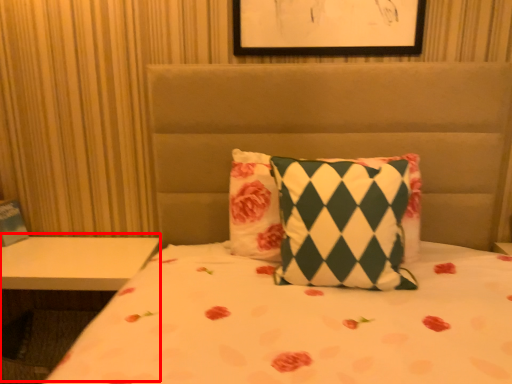
Question: In this image, where is table (annotated by the red box) located relative to pillow?

Choices:
 (A) left
 (B) right

Answer: (A)